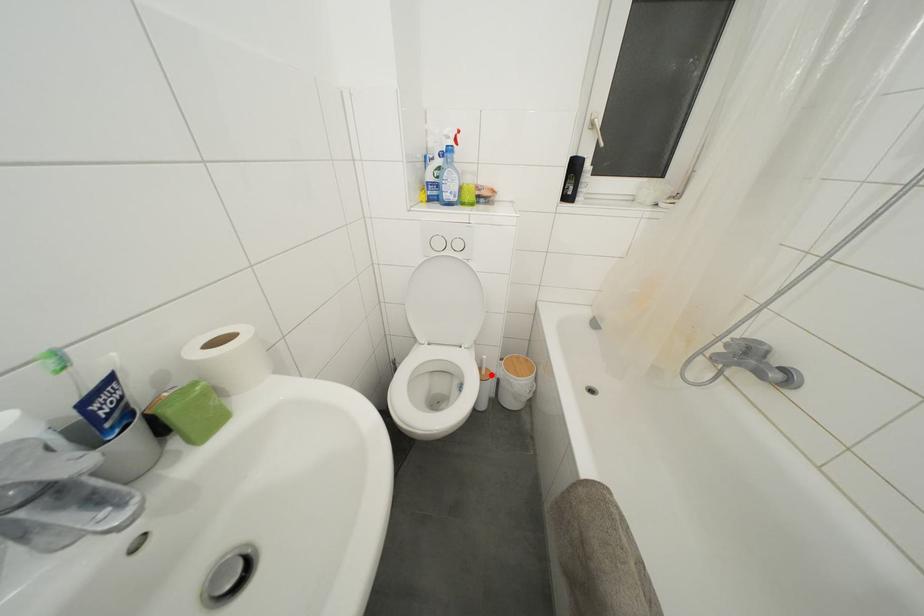
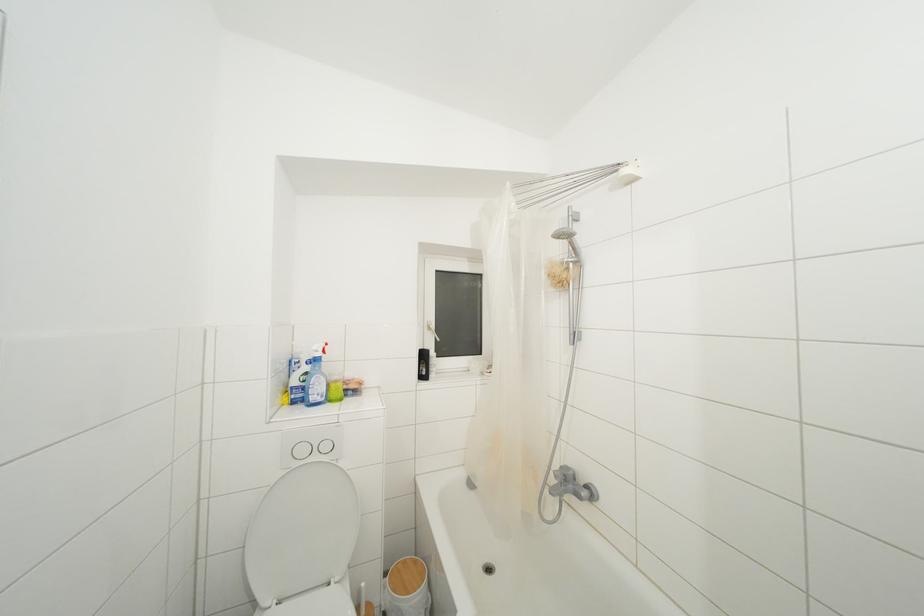
Question: I am providing you with two images of the same scene from different viewpoints. A red point is shown in image1. For the corresponding object point in image2, is it positioned nearer or farther from the camera?

Choices:
 (A) Nearer
 (B) Farther

Answer: (A)